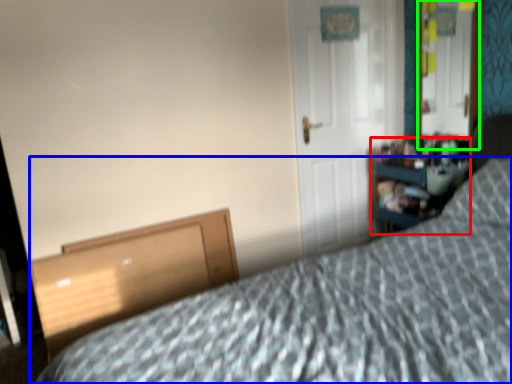
Question: Considering the real-world distances, which object is closest to dresser (highlighted by a red box)? bed (highlighted by a blue box) or mirror (highlighted by a green box).

Choices:
 (A) bed
 (B) mirror

Answer: (B)